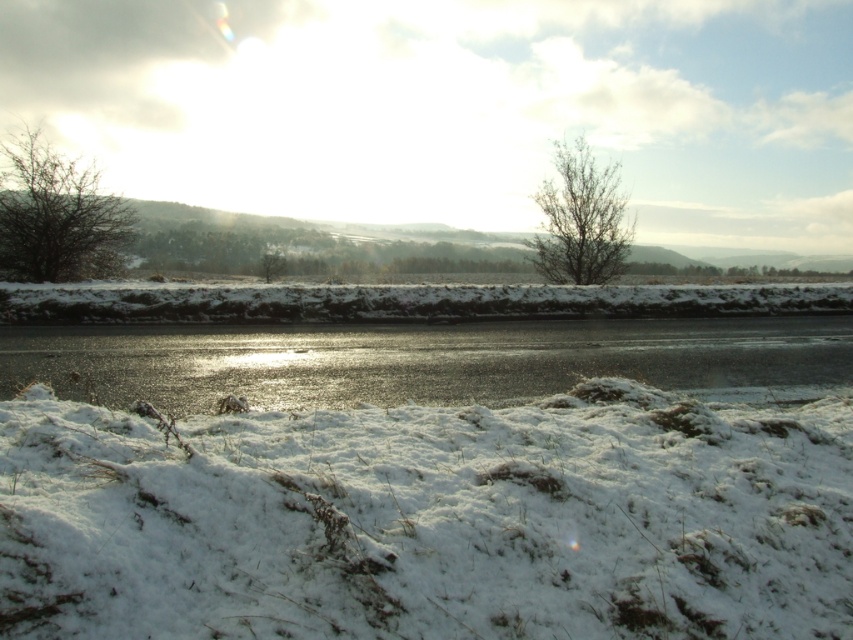
Based on the photo, you are a bird looking for a higher perch. You see the bare branches at left and the bare branches at upper center. Which one should you choose?

The bare branches at left are taller than the bare branches at upper center, so you should choose the bare branches at left for a higher perch.

You are standing at the point marked as point (428, 518) in the image. Looking around, you notice white fluffy snow at lower left. What is directly beneath your feet at this point?

The white fluffy snow at lower left is directly beneath your feet at point (428, 518).